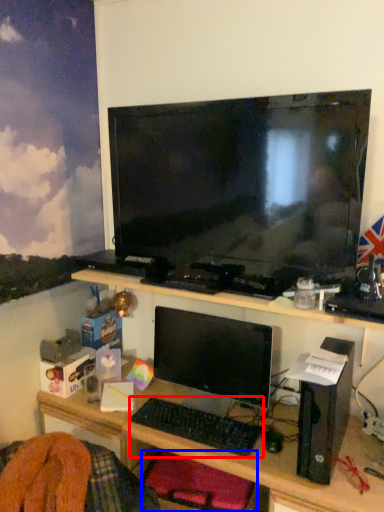
Question: Among these objects, which one is nearest to the camera, computer keyboard (highlighted by a red box) or computer chair (highlighted by a blue box)?

Choices:
 (A) computer keyboard
 (B) computer chair

Answer: (B)